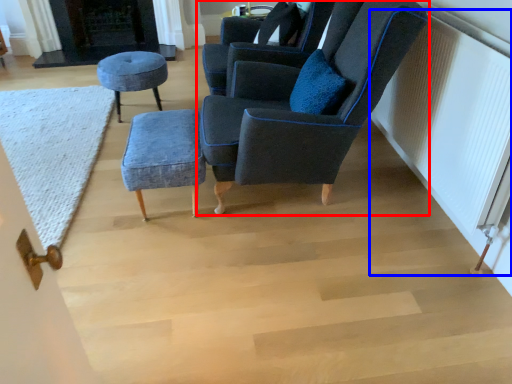
Question: Which object appears farthest to the camera in this image, chair (highlighted by a red box) or radiator (highlighted by a blue box)?

Choices:
 (A) chair
 (B) radiator

Answer: (A)